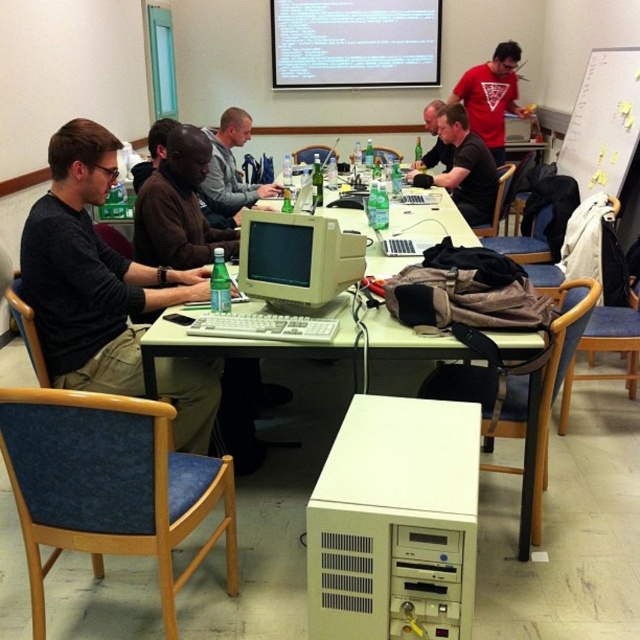
Question: Among these objects, which one is nearest to the camera?

Choices:
 (A) matte red t-shirt at upper center
 (B) brown sweater at center

Answer: (B)

Question: Is white plastic table at center wider than black shirt at center?

Choices:
 (A) no
 (B) yes

Answer: (B)

Question: Which is farther from the brown sweater at center?

Choices:
 (A) gray sweater at center
 (B) matte red t-shirt at upper center
 (C) matte black shirt at center
 (D) matte black shirt at left

Answer: (B)

Question: Estimate the real-world distances between objects in this image. Which object is farther from the white plastic table at center?

Choices:
 (A) matte red t-shirt at upper center
 (B) white plastic desktop computer at lower center
 (C) matte black shirt at left

Answer: (A)

Question: Is matte plastic monitor at center to the left of matte red t-shirt at upper center from the viewer's perspective?

Choices:
 (A) yes
 (B) no

Answer: (A)

Question: Does matte black shirt at left appear on the right side of white plastic table at center?

Choices:
 (A) yes
 (B) no

Answer: (B)